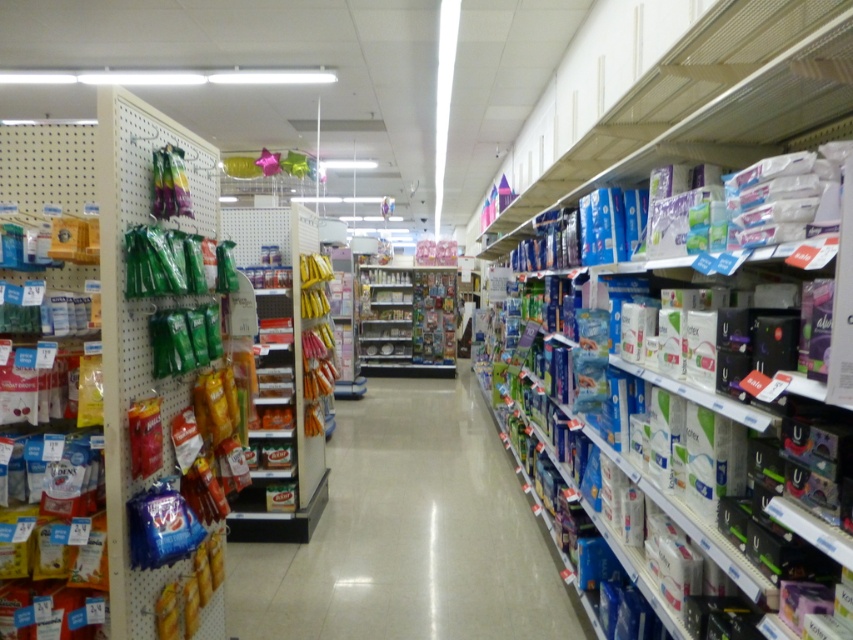
You are a store employee who needs to place a new box of cereal that is 18 inches tall. The box must be placed on either the blue plastic shelf at center or the metallic silver shelves at center. Based on their positions, which shelf can accommodate the box without it exceeding the shelf height?

The blue plastic shelf at center is positioned under the metallic silver shelves at center. Since the blue plastic shelf is lower, it likely has more vertical space available. Therefore, the box of cereal should be placed on the blue plastic shelf at center to ensure it doesn

You are a store employee who needs to reach the green matte snack packet at left and the metallic silver shelves at center. Which object is taller?

The green matte snack packet at left is much taller than the metallic silver shelves at center.

You are standing in the retail store and want to find the blue plastic shelf at center. According to the store map, the coordinates of the blue plastic shelf at center are at point [410,532]. Can you locate it using the map?

The blue plastic shelf at center is located at point [410,532], so you can find it by navigating to those coordinates on the store map.